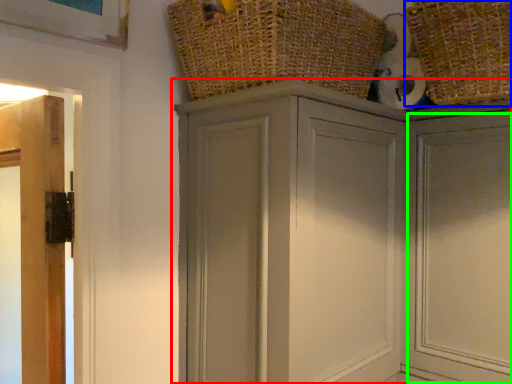
Question: Based on their relative distances, which object is nearer to cupboard (highlighted by a red box)? Choose from basket (highlighted by a blue box) and door (highlighted by a green box).

Choices:
 (A) basket
 (B) door

Answer: (B)